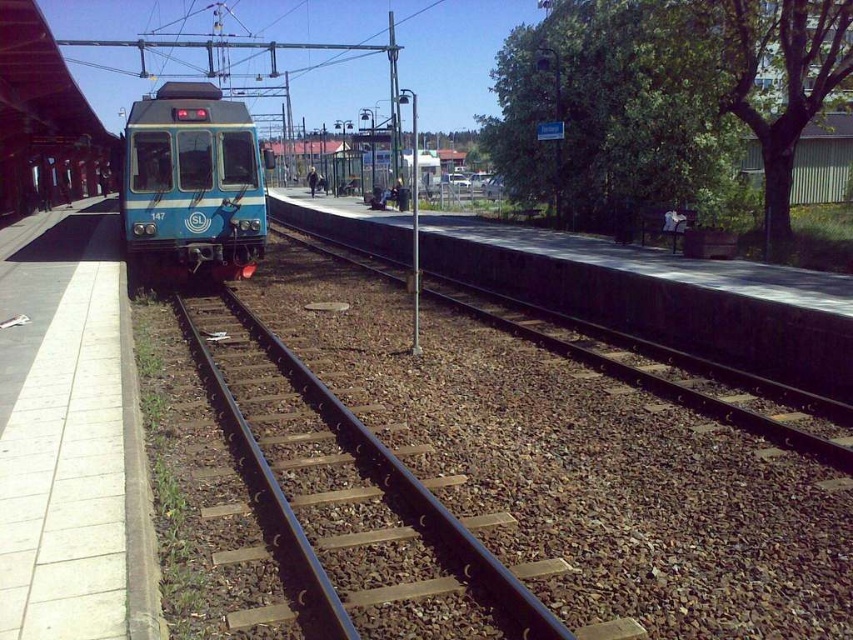
Question: Estimate the real-world distances between objects in this image. Which object is closer to the black metal track at center?

Choices:
 (A) black metal train track at center
 (B) blue glossy train at center

Answer: (A)

Question: Is black metal track at center closer to camera compared to blue glossy train at center?

Choices:
 (A) no
 (B) yes

Answer: (B)

Question: Does black metal track at center appear on the right side of blue glossy train at center?

Choices:
 (A) no
 (B) yes

Answer: (B)

Question: Based on their relative distances, which object is nearer to the black metal train track at center?

Choices:
 (A) blue glossy train at center
 (B) black metal track at center

Answer: (B)

Question: In this image, where is black metal track at center located relative to black metal train track at center?

Choices:
 (A) right
 (B) left

Answer: (B)

Question: Among these points, which one is farthest from the camera?

Choices:
 (A) (746, 429)
 (B) (231, 122)
 (C) (209, 355)

Answer: (B)